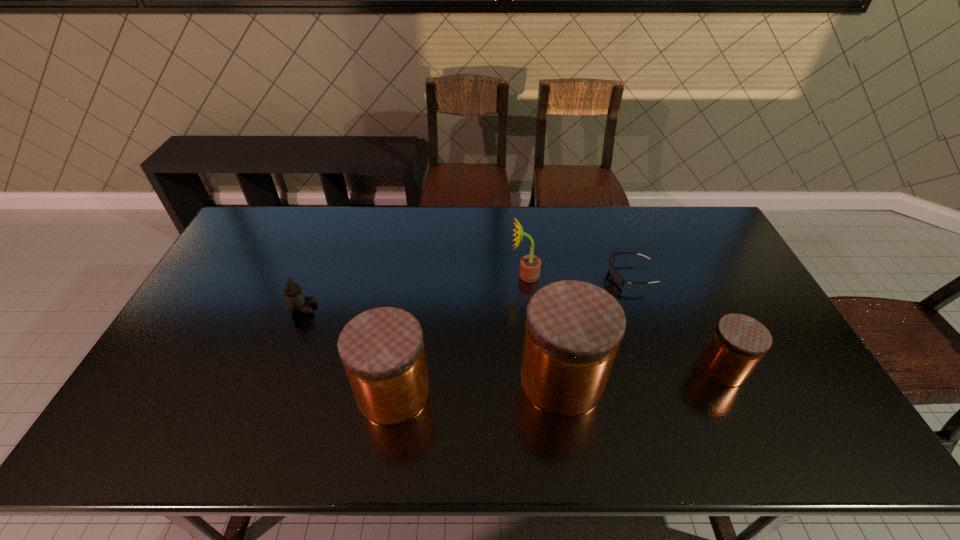
You are a GUI agent. You are given a task and a screenshot of the screen. Output one action in this format:
    pyautogui.click(x=<x>, y=<y>)
    Task: Click on the blank area located on the back of the second shortest jar
    
    Given the screenshot: What is the action you would take?
    pyautogui.click(x=407, y=307)

Locate an element on the screen. free location located on the left of the second jar from right to left is located at coordinates (486, 379).

Image resolution: width=960 pixels, height=540 pixels. I want to click on vacant space positioned 0.090m on the left of the fourth tallest object, so click(665, 367).

Image resolution: width=960 pixels, height=540 pixels. I want to click on free space located on the face of the fourth nearest object, so click(x=444, y=308).

The image size is (960, 540). Find the location of `free space located 0.060m on the face of the sunflower`. free space located 0.060m on the face of the sunflower is located at coordinates (492, 275).

Image resolution: width=960 pixels, height=540 pixels. What are the coordinates of `free space located on the face of the sunflower` in the screenshot? It's located at (443, 275).

Where is `free space located on the face of the sunflower`? The width and height of the screenshot is (960, 540). free space located on the face of the sunflower is located at coordinates (486, 275).

Where is `free space located 0.140m on the lenses of the second object from right to left`? This screenshot has width=960, height=540. free space located 0.140m on the lenses of the second object from right to left is located at coordinates (564, 275).

You are a GUI agent. You are given a task and a screenshot of the screen. Output one action in this format:
    pyautogui.click(x=<x>, y=<y>)
    Task: Click on the free space located 0.200m on the lenses of the second object from right to left
    The height and width of the screenshot is (540, 960).
    Given the screenshot: What is the action you would take?
    pyautogui.click(x=545, y=275)

Where is `free space located on the lenses of the second object from right to left`? The height and width of the screenshot is (540, 960). free space located on the lenses of the second object from right to left is located at coordinates (502, 275).